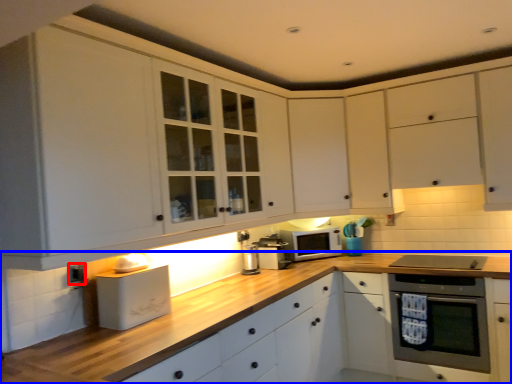
Question: Among these objects, which one is nearest to the camera, electric outlet (highlighted by a red box) or countertop (highlighted by a blue box)?

Choices:
 (A) electric outlet
 (B) countertop

Answer: (B)